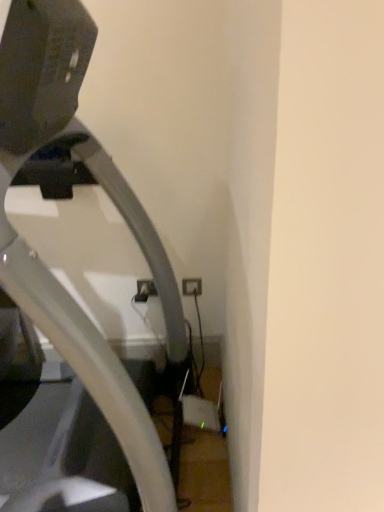
Question: Considering the relative sizes of white plastic electric outlet at lower center and metallic gray treadmill at left in the image provided, is white plastic electric outlet at lower center taller than metallic gray treadmill at left?

Choices:
 (A) no
 (B) yes

Answer: (A)

Question: Can you confirm if white plastic electric outlet at lower center is positioned to the right of metallic gray treadmill at left?

Choices:
 (A) no
 (B) yes

Answer: (B)

Question: From a real-world perspective, is white plastic electric outlet at lower center located higher than metallic gray treadmill at left?

Choices:
 (A) no
 (B) yes

Answer: (A)

Question: Is white plastic electric outlet at lower center positioned in front of metallic gray treadmill at left?

Choices:
 (A) yes
 (B) no

Answer: (B)

Question: From the image's perspective, is white plastic electric outlet at lower center beneath metallic gray treadmill at left?

Choices:
 (A) no
 (B) yes

Answer: (B)

Question: Is metallic gray treadmill at left surrounded by white plastic electric outlet at lower center?

Choices:
 (A) yes
 (B) no

Answer: (B)

Question: Considering the relative sizes of metallic gray treadmill at left and white plastic electric outlet at lower center in the image provided, is metallic gray treadmill at left shorter than white plastic electric outlet at lower center?

Choices:
 (A) yes
 (B) no

Answer: (B)

Question: From the image's perspective, is metallic gray treadmill at left beneath white plastic electric outlet at lower center?

Choices:
 (A) yes
 (B) no

Answer: (B)

Question: From the image's perspective, does metallic gray treadmill at left appear higher than white plastic electric outlet at lower center?

Choices:
 (A) no
 (B) yes

Answer: (B)

Question: Is metallic gray treadmill at left positioned far away from white plastic electric outlet at lower center?

Choices:
 (A) no
 (B) yes

Answer: (A)

Question: From a real-world perspective, is metallic gray treadmill at left positioned under white plastic electric outlet at lower center based on gravity?

Choices:
 (A) yes
 (B) no

Answer: (B)

Question: Is metallic gray treadmill at left turned away from white plastic electric outlet at lower center?

Choices:
 (A) no
 (B) yes

Answer: (A)

Question: Considering the positions of metallic gray treadmill at left and white plastic electric outlet at lower center in the image, is metallic gray treadmill at left taller or shorter than white plastic electric outlet at lower center?

Choices:
 (A) short
 (B) tall

Answer: (B)